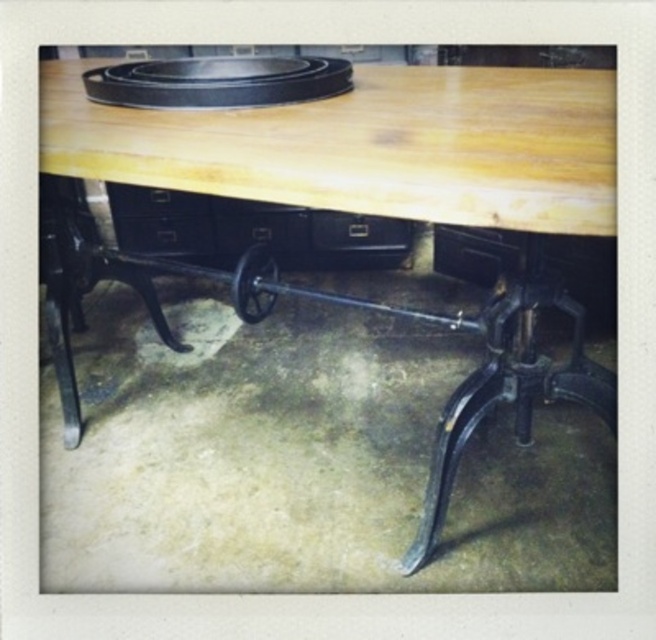
In the scene shown: You are a painter standing in front of the natural wood table at center. Your brush is on the table, and you want to reach it without moving your feet. Can you do it?

The natural wood table at center is 59.45 centimeters away from you. Since the average human arm length is about 60 centimeters, you can just barely reach the brush on the table without moving your feet.

You are a carpenter who needs to place a heavy tool on the surface. Which object between the natural wood table at center and the black matte drawer at center would be more stable for this task?

The natural wood table at center has a greater height compared to the black matte drawer at center. Since the table is taller, it likely provides a more stable surface for placing heavy tools due to its robust construction and larger base support.

You are standing in the workshop and want to place a heavy tool on the natural wood table at center. Based on its 2D coordinates, is the table positioned closer to the left or right side of the room?

The natural wood table at center is located at coordinates point (344,209), which places it closer to the left side of the room.